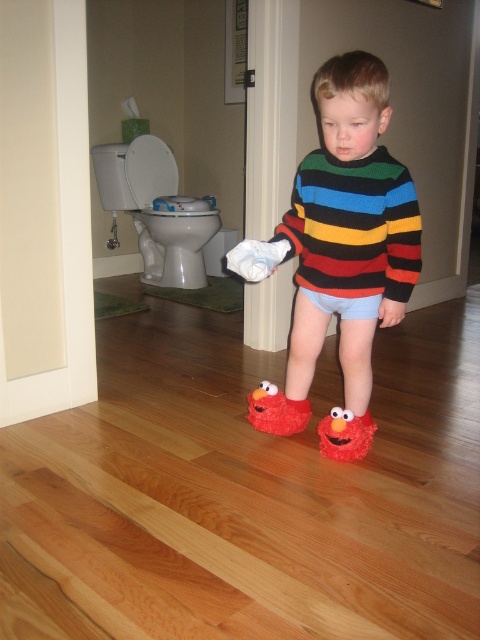
Question: From the image, what is the correct spatial relationship of fluffy red elmo slippers at lower center in relation to white soft socks at center?

Choices:
 (A) right
 (B) left

Answer: (A)

Question: Can you confirm if multicolored knitted sweater at center is positioned to the left of fluffy red elmo slippers at lower center?

Choices:
 (A) no
 (B) yes

Answer: (A)

Question: Which object is positioned closest to the white soft socks at center?

Choices:
 (A) multicolored knitted sweater at center
 (B) fluffy red elmo slippers at lower center

Answer: (A)

Question: Can you confirm if multicolored knitted sweater at center is bigger than white soft socks at center?

Choices:
 (A) yes
 (B) no

Answer: (A)

Question: Among these points, which one is nearest to the camera?

Choices:
 (A) (285, 397)
 (B) (239, 256)
 (C) (325, 433)
 (D) (392, 244)

Answer: (B)

Question: Which object is the farthest from the white soft socks at center?

Choices:
 (A) multicolored knitted sweater at center
 (B) fluffy red elmo slippers at lower center

Answer: (B)